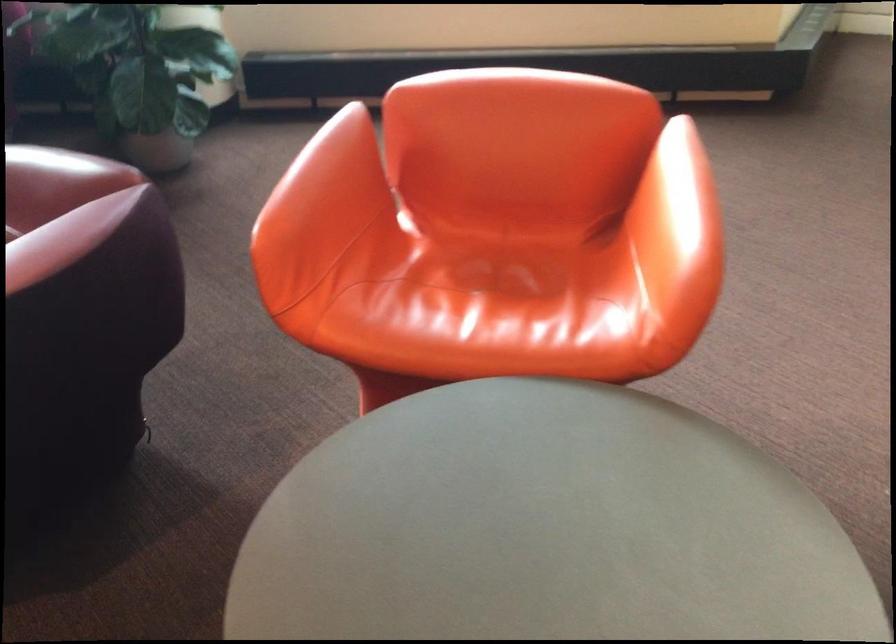
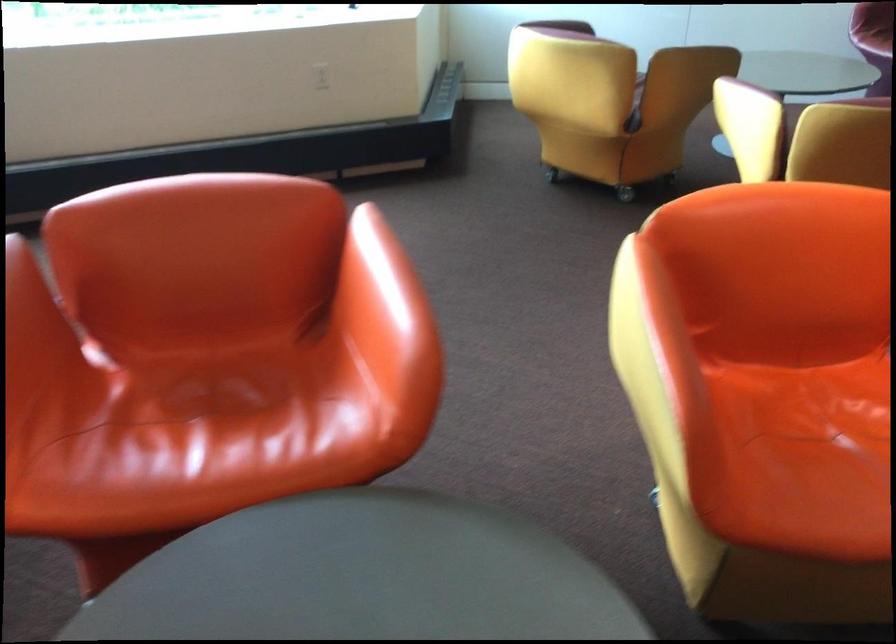
Question: The camera is either moving clockwise (left) or counter-clockwise (right) around the object. The first image is from the beginning of the video and the second image is from the end. Is the camera moving left or right when shooting the video?

Choices:
 (A) Left
 (B) Right

Answer: (A)